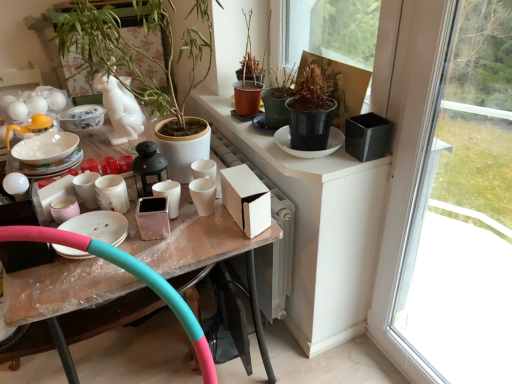
Locate an element on the screen. free space above matte white teapot at upper left (from a real-world perspective) is located at coordinates (45, 146).